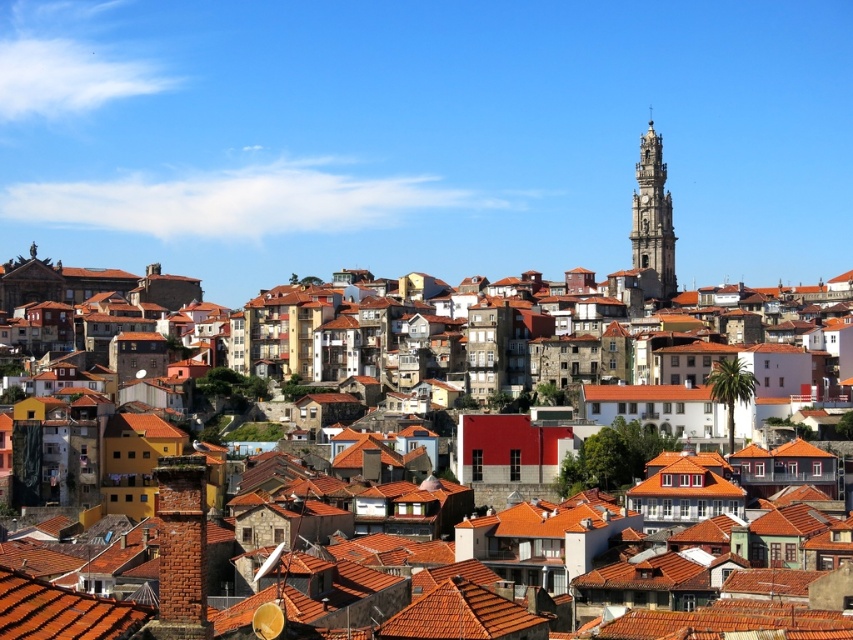
In the scene shown: You are an architect observing the cityscape and need to determine the spatial relationship between the terracotta clay rooftops at center and the golden stone tower at upper right. Which object is located above the other?

The golden stone tower at upper right is positioned above the terracotta clay rooftops at center.

You are an architect analyzing the city layout. You observe the terracotta clay rooftops at center and the golden stone tower at upper right. Which of these two structures is located to the right of the other?

The golden stone tower at upper right is positioned to the right of the terracotta clay rooftops at center.

You are an architect analyzing the city layout. You observe the terracotta clay rooftops at center and the golden stone tower at upper right. Which structure is positioned nearer to your viewpoint?

The terracotta clay rooftops at center is closer to the viewer than the golden stone tower at upper right.